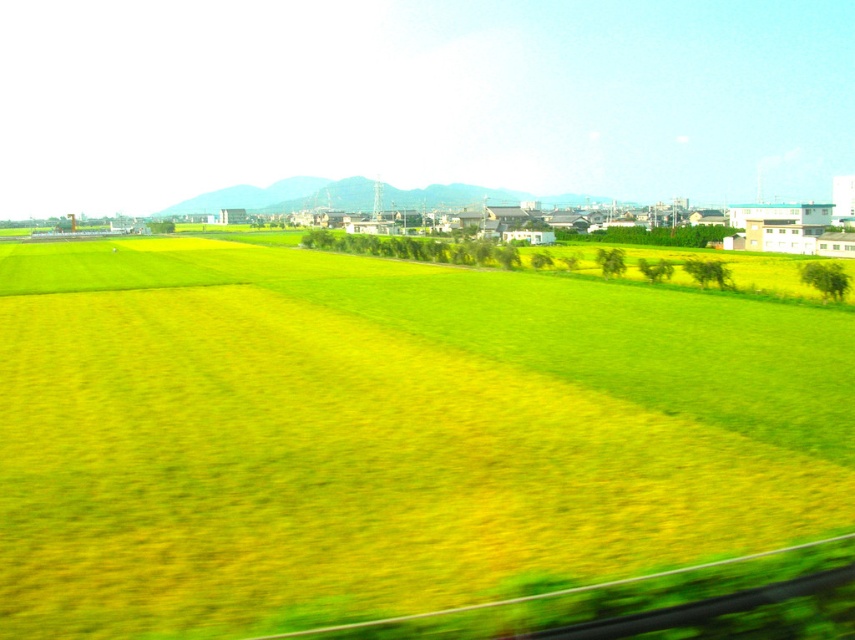
Is green grassy field at center closer to camera compared to green grassy hill at center?

Yes, green grassy field at center is closer to the viewer.

Between green grassy field at center and green grassy hill at center, which one appears on the left side from the viewer's perspective?

Positioned to the left is green grassy hill at center.

Who is more distant from viewer, (89, 362) or (461, 202)?

The point (461, 202) is behind.

The image size is (855, 640). I want to click on green grassy field at center, so click(x=384, y=433).